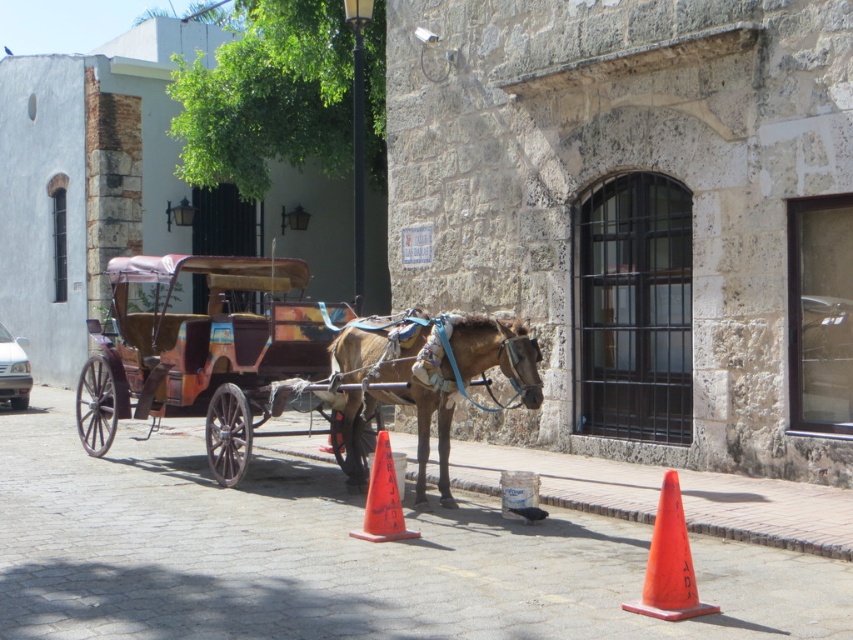
You are a delivery person trying to park your bike between the brown leather horse at center and the orange plastic cone at lower center. Can your bike, which is 1 meter wide, fit in the space between them?

The brown leather horse at center is wider than the orange plastic cone at lower center. The space between them is narrower than the horse, but since the exact width isn t specified, we can infer that the bike might not fit. However, the description only states the horse is wider than the cone, so the available space could vary. Without precise measurements, it s uncertain. But since the horse is wider, the space between them might be too narrow for a 1m bike. Therefore, it s likely too narrow.

You are standing on the cobblestone street and want to reach the point at coordinates point [231,468]. If your walking speed is 1.5 meters per second, how many seconds will it take you to reach that point?

The distance between you and point [231,468] is 10.16 meters. At a walking speed of 1.5 meters per second, it will take approximately 6.77 seconds to reach the point.